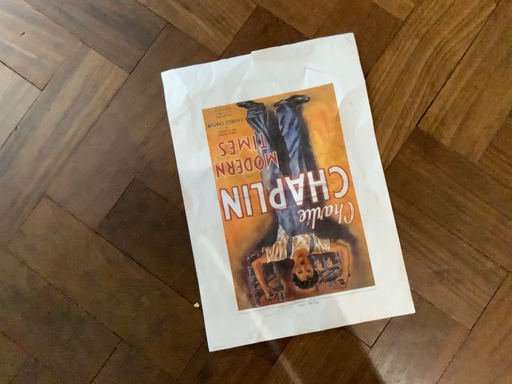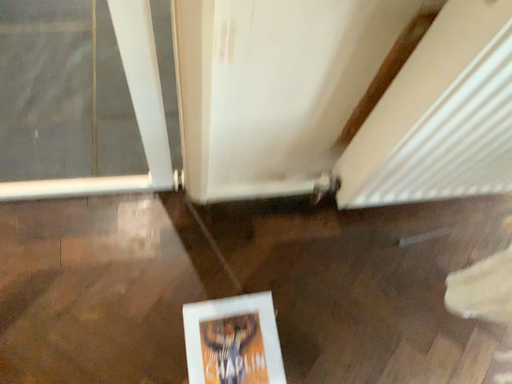
Question: How did the camera likely rotate when shooting the video?

Choices:
 (A) rotated downward
 (B) rotated upward

Answer: (B)